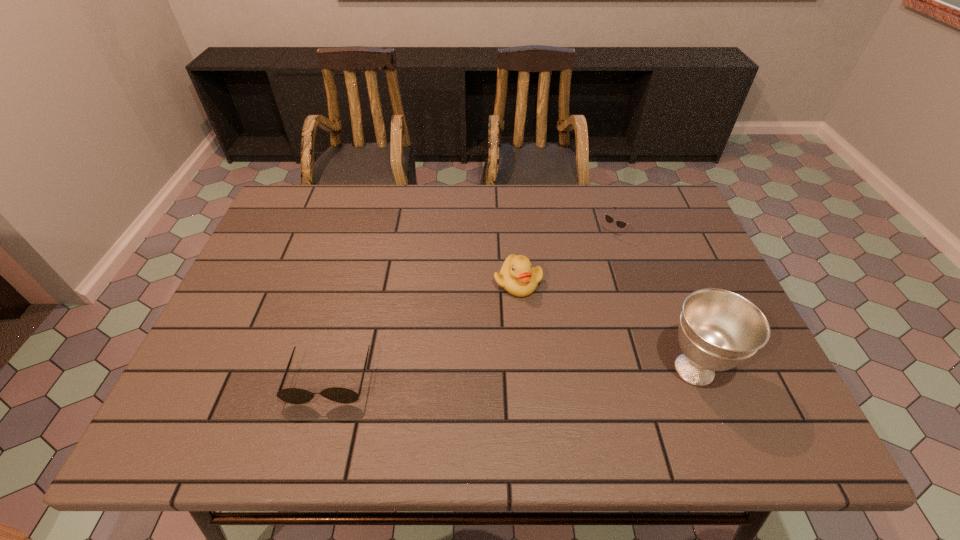
Where is `free space at the near edge`? The height and width of the screenshot is (540, 960). free space at the near edge is located at coordinates (692, 385).

In the image, there is a desktop. At what (x,y) coordinates should I click in order to perform the action: click on vacant space at the left edge. Please return your answer as a coordinate pair (x, y). Looking at the image, I should click on (238, 299).

Find the location of a particular element. The image size is (960, 540). free space at the right edge is located at coordinates (670, 269).

The image size is (960, 540). In order to click on vacant space at the far right corner of the desktop in this screenshot , I will do `click(623, 191)`.

You are a GUI agent. You are given a task and a screenshot of the screen. Output one action in this format:
    pyautogui.click(x=<x>, y=<y>)
    Task: Click on the unoccupied area between the tallest object and the second farthest object
    The height and width of the screenshot is (540, 960).
    Given the screenshot: What is the action you would take?
    (606, 326)

Find the location of `free spot between the second tallest object and the tallest object`. free spot between the second tallest object and the tallest object is located at coordinates (606, 326).

The width and height of the screenshot is (960, 540). Identify the location of empty space that is in between the nearer sunglasses and the farther sunglasses. (469, 307).

Identify the location of free space between the third nearest object and the leftmost object. The image size is (960, 540). (423, 330).

Locate an element on the screen. The width and height of the screenshot is (960, 540). free spot between the left sunglasses and the second object from left to right is located at coordinates (423, 330).

The image size is (960, 540). Find the location of `free space that is in between the nearer sunglasses and the second tallest object`. free space that is in between the nearer sunglasses and the second tallest object is located at coordinates (423, 330).